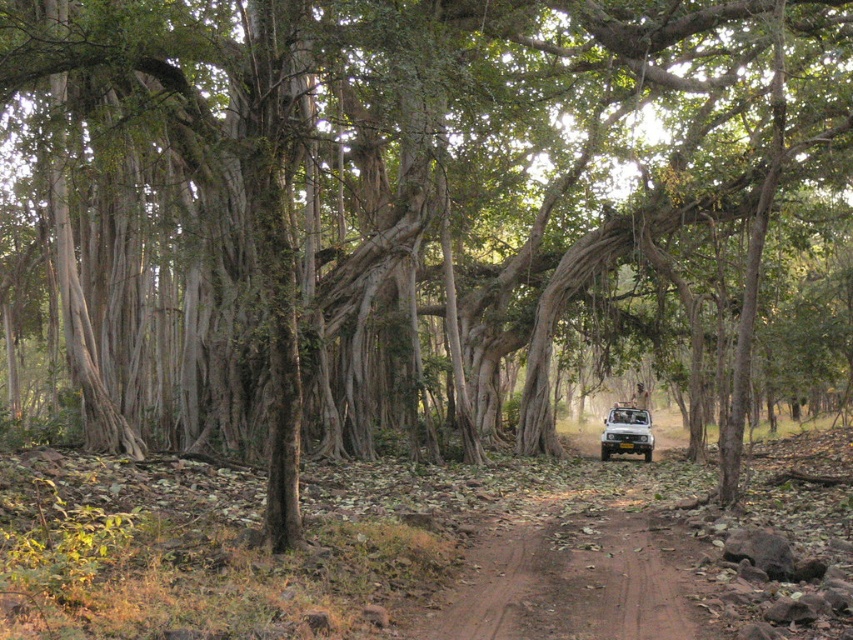
Question: Does brown dirt track at center appear under yellow matte jeep at center?

Choices:
 (A) yes
 (B) no

Answer: (B)

Question: Which object is closer to the camera taking this photo?

Choices:
 (A) brown dirt track at center
 (B) yellow matte jeep at center

Answer: (A)

Question: Which object is closer to the camera taking this photo?

Choices:
 (A) yellow matte jeep at center
 (B) brown dirt track at center

Answer: (B)

Question: Where is brown dirt track at center located in relation to yellow matte jeep at center in the image?

Choices:
 (A) right
 (B) left

Answer: (B)

Question: Can you confirm if brown dirt track at center is positioned below yellow matte jeep at center?

Choices:
 (A) yes
 (B) no

Answer: (B)